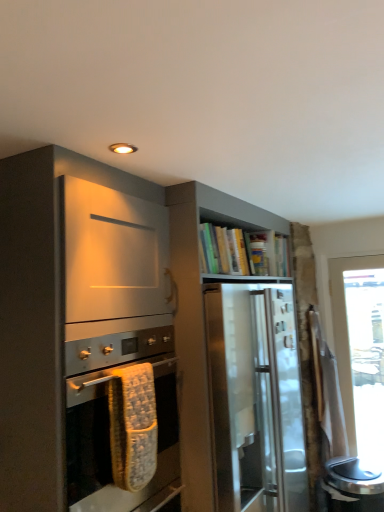
Question: Is satin wood cabinet at upper center bigger than matte silver oven at center?

Choices:
 (A) no
 (B) yes

Answer: (B)

Question: Is satin wood cabinet at upper center further to the viewer compared to matte silver oven at center?

Choices:
 (A) yes
 (B) no

Answer: (A)

Question: From the image's perspective, is satin wood cabinet at upper center on top of matte silver oven at center?

Choices:
 (A) no
 (B) yes

Answer: (A)

Question: Is satin wood cabinet at upper center looking in the opposite direction of matte silver oven at center?

Choices:
 (A) yes
 (B) no

Answer: (B)

Question: From a real-world perspective, is satin wood cabinet at upper center on top of matte silver oven at center?

Choices:
 (A) no
 (B) yes

Answer: (A)

Question: Is satin wood cabinet at upper center not near matte silver oven at center?

Choices:
 (A) no
 (B) yes

Answer: (A)

Question: Is matte silver oven at center positioned beyond the bounds of satin wood cabinet at upper center?

Choices:
 (A) yes
 (B) no

Answer: (A)

Question: Does matte silver oven at center have a greater width compared to satin wood cabinet at upper center?

Choices:
 (A) yes
 (B) no

Answer: (B)

Question: From the image's perspective, would you say matte silver oven at center is positioned over satin wood cabinet at upper center?

Choices:
 (A) yes
 (B) no

Answer: (A)

Question: From the image's perspective, is matte silver oven at center located beneath satin wood cabinet at upper center?

Choices:
 (A) yes
 (B) no

Answer: (B)

Question: Is matte silver oven at center bigger than satin wood cabinet at upper center?

Choices:
 (A) yes
 (B) no

Answer: (B)

Question: Is matte silver oven at center oriented away from satin wood cabinet at upper center?

Choices:
 (A) no
 (B) yes

Answer: (A)

Question: Would you say matte silver oven at center is inside or outside satin wood cabinet at upper center?

Choices:
 (A) inside
 (B) outside

Answer: (B)